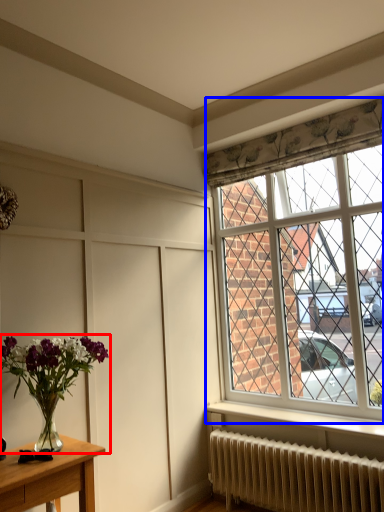
Question: Which of the following is the closest to the observer, houseplant (highlighted by a red box) or window (highlighted by a blue box)?

Choices:
 (A) houseplant
 (B) window

Answer: (A)